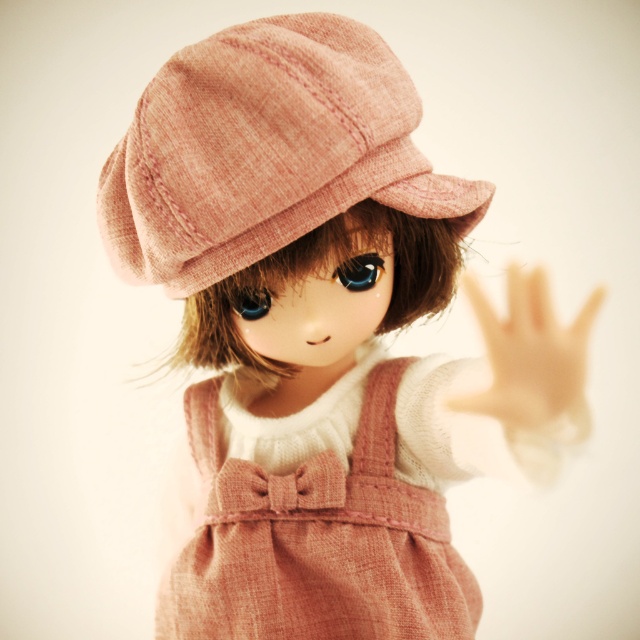
Who is positioned more to the right, rust-colored linen dress at center or translucent flesh at center?

translucent flesh at center

Is point (392, 580) positioned behind point (552, 349)?

Yes, it is behind point (552, 349).

Locate an element on the screen. The image size is (640, 640). rust-colored linen dress at center is located at coordinates (316, 540).

You are a GUI agent. You are given a task and a screenshot of the screen. Output one action in this format:
    pyautogui.click(x=<x>, y=<y>)
    Task: Click on the rust-colored linen dress at center
    
    Given the screenshot: What is the action you would take?
    pyautogui.click(x=316, y=540)

Does point (184, 104) lie behind point (500, 337)?

Yes.

Is point (198, 109) positioned in front of point (572, 333)?

No, (198, 109) is further to viewer.

The width and height of the screenshot is (640, 640). In order to click on pink woolen cap at upper center in this screenshot , I will do `click(266, 150)`.

Consider the image. Between pink woolen cap at upper center and rust-colored linen dress at center, which one is positioned higher?

pink woolen cap at upper center is higher up.

At what (x,y) coordinates should I click in order to perform the action: click on pink woolen cap at upper center. Please return your answer as a coordinate pair (x, y). The image size is (640, 640). Looking at the image, I should click on (266, 150).